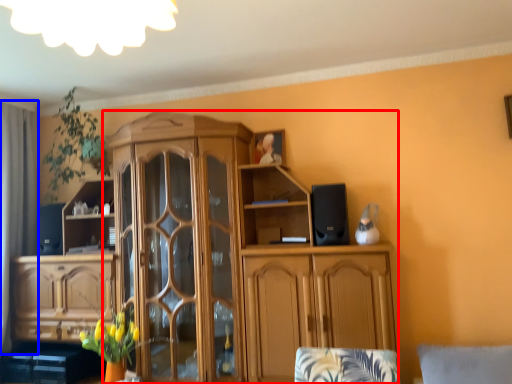
Question: Which of the following is the closest to the observer, cabinetry (highlighted by a red box) or curtain (highlighted by a blue box)?

Choices:
 (A) cabinetry
 (B) curtain

Answer: (A)